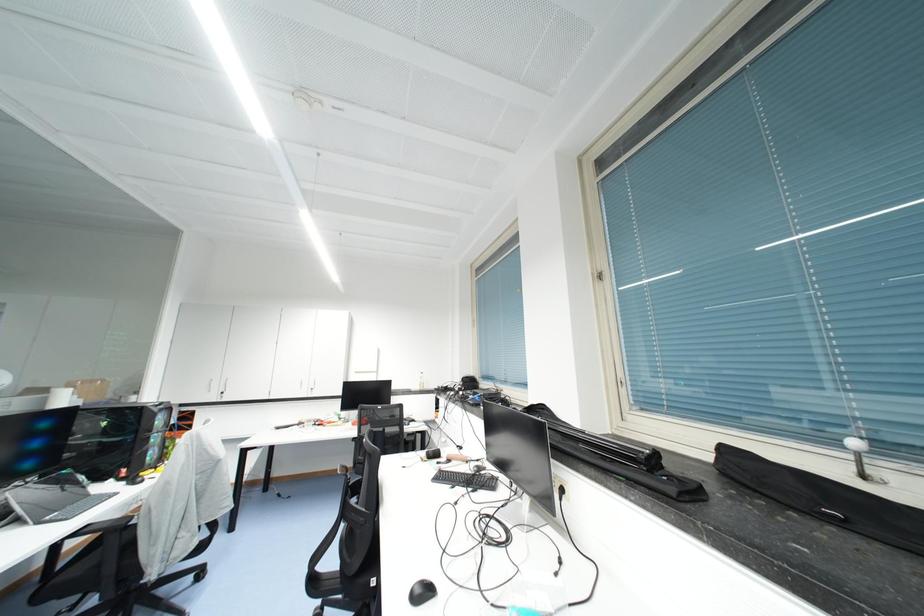
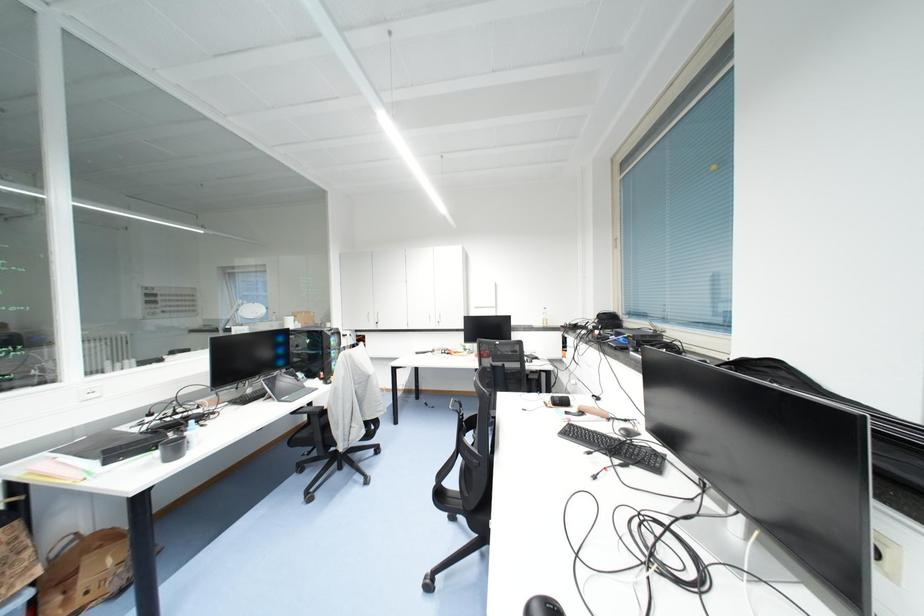
Question: The camera is either moving clockwise (left) or counter-clockwise (right) around the object. The first image is from the beginning of the video and the second image is from the end. Is the camera moving left or right when shooting the video?

Choices:
 (A) Left
 (B) Right

Answer: (B)